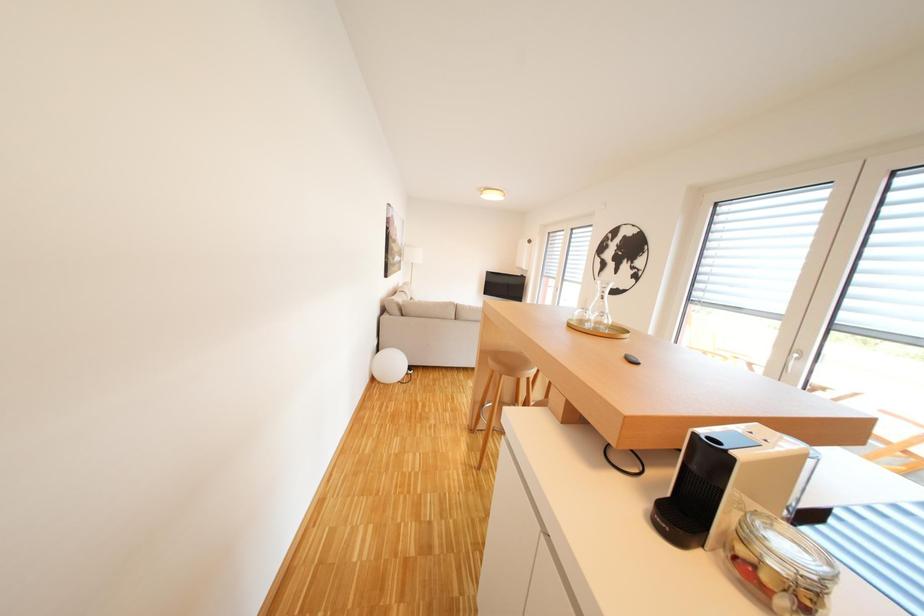
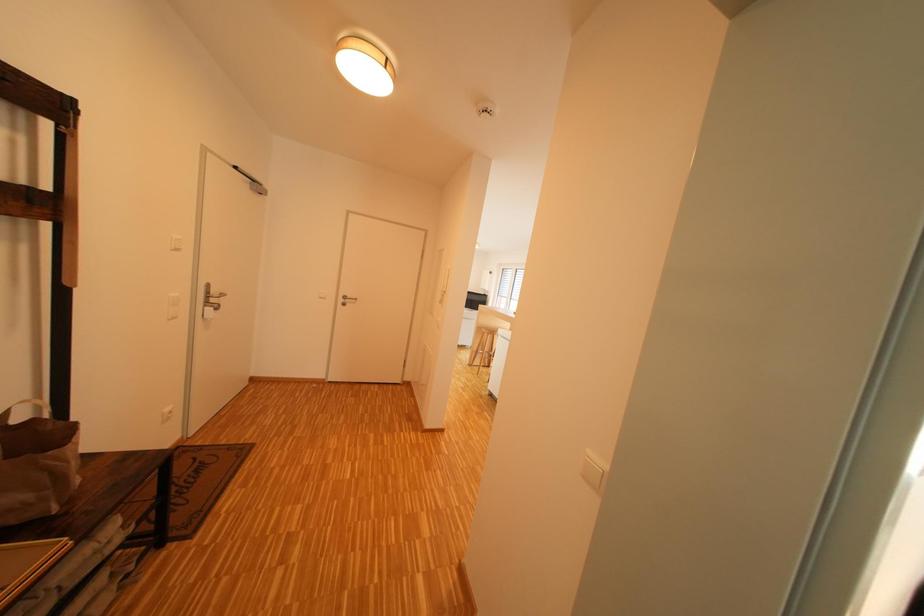
In a continuous first-person perspective shot, in which direction is the camera moving?

The movement direction of the cameraman is left, backward.